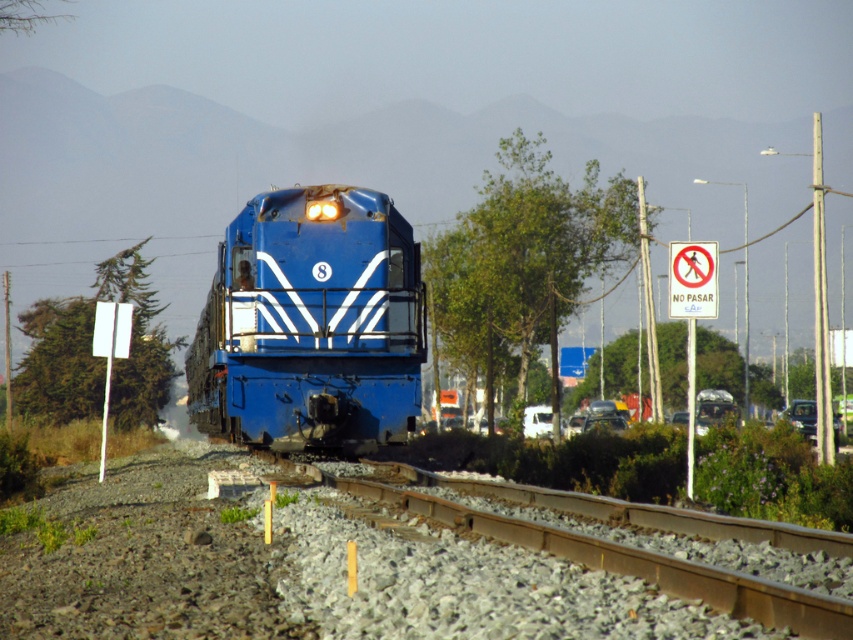
Does blue glossy locomotive at center appear over white matte van at center?

Yes, blue glossy locomotive at center is above white matte van at center.

What do you see at coordinates (311, 324) in the screenshot?
I see `blue glossy locomotive at center` at bounding box center [311, 324].

Between point (283, 372) and point (535, 410), which one is positioned in front?

Positioned in front is point (283, 372).

The image size is (853, 640). What are the coordinates of `blue glossy locomotive at center` in the screenshot? It's located at (311, 324).

Is rusty metal train track at center positioned behind white matte van at center?

No, it is in front of white matte van at center.

Find the location of a particular element. The image size is (853, 640). rusty metal train track at center is located at coordinates (624, 561).

The height and width of the screenshot is (640, 853). Identify the location of rusty metal train track at center. (624, 561).

Does blue glossy locomotive at center have a greater height compared to rusty metal train track at center?

Yes, blue glossy locomotive at center is taller than rusty metal train track at center.

Who is higher up, blue glossy locomotive at center or rusty metal train track at center?

blue glossy locomotive at center is higher up.

In the scene shown: Who is more forward, (338, 337) or (845, 637)?

Positioned in front is point (845, 637).

You are a GUI agent. You are given a task and a screenshot of the screen. Output one action in this format:
    pyautogui.click(x=<x>, y=<y>)
    Task: Click on the blue glossy locomotive at center
    The width and height of the screenshot is (853, 640).
    Given the screenshot: What is the action you would take?
    pyautogui.click(x=311, y=324)